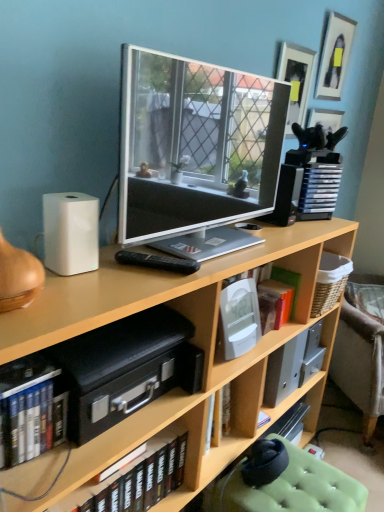
Find the location of a particular element. free space that is in between matte silver tv at center and white matte speaker at left, the 2th speaker from the top is located at coordinates (111, 273).